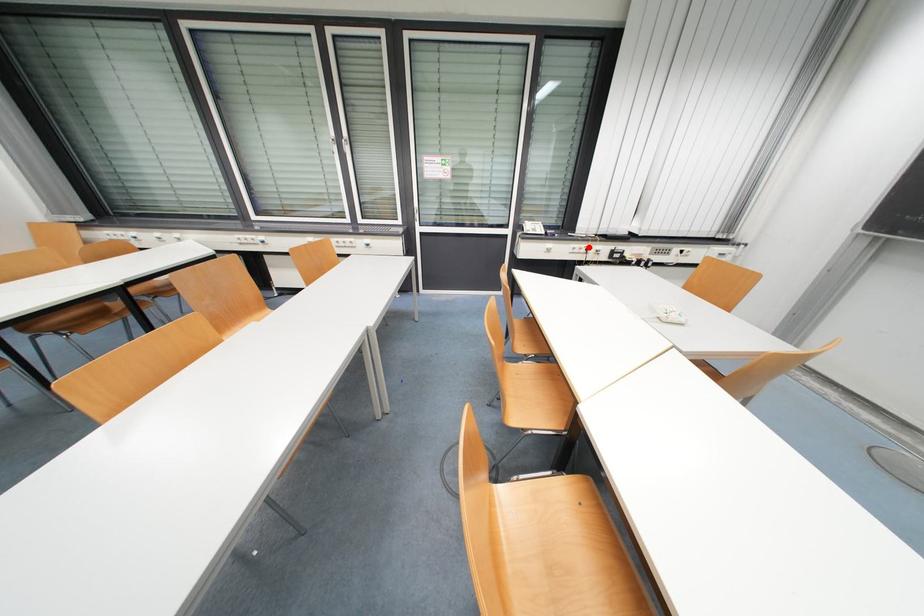
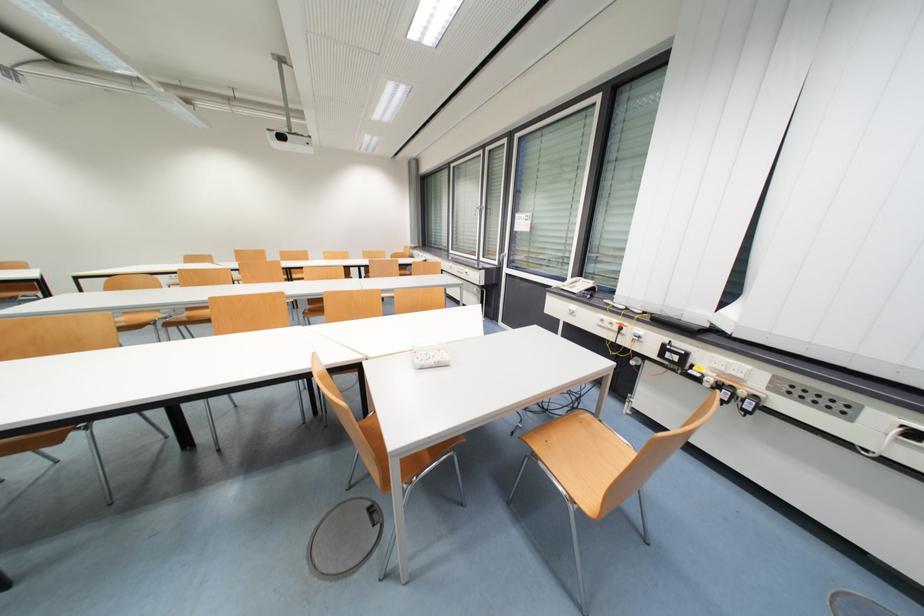
Question: I am providing you with two images of the same scene from different viewpoints. Image1 has a red point marked. In image2, the corresponding 3D location appears at what relative position? Reply with the corresponding letter.

Choices:
 (A) Closer
 (B) Farther

Answer: (B)